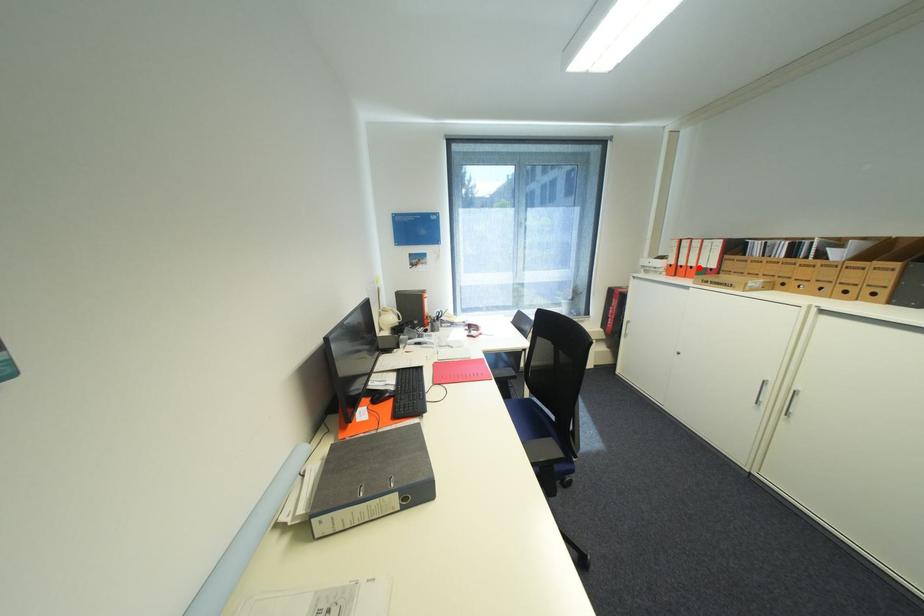
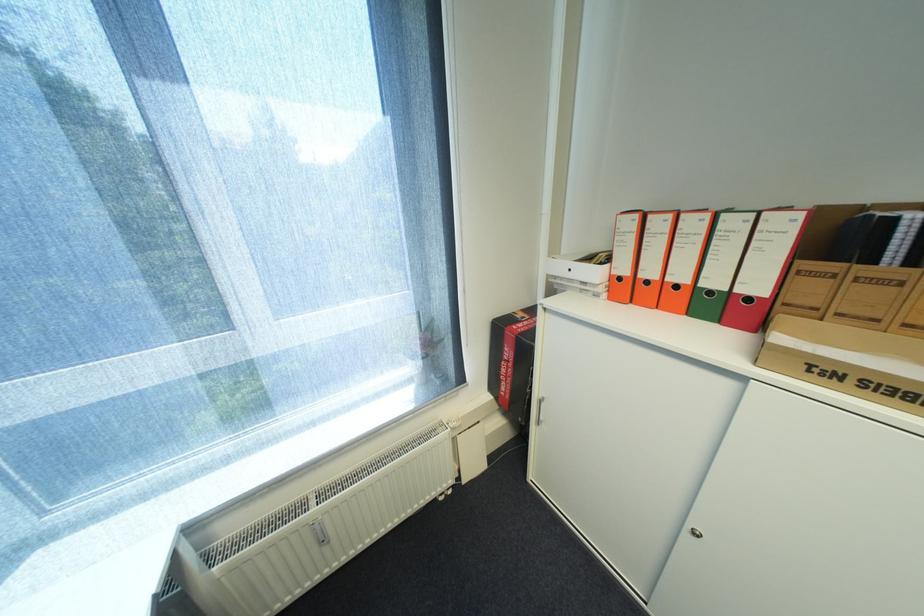
Where in the second image is the point corresponding to the highlighted location from the first image?

(685, 286)